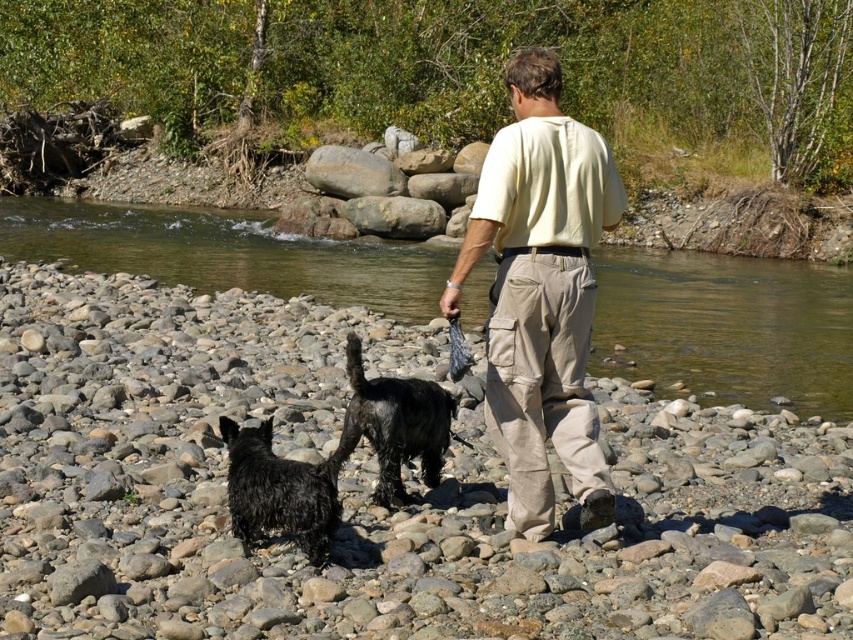
Question: Does clear water at river center have a greater width compared to khaki cargo pants at center?

Choices:
 (A) no
 (B) yes

Answer: (B)

Question: Is beige cotton shirt at center bigger than khaki cargo pants at center?

Choices:
 (A) yes
 (B) no

Answer: (B)

Question: Which object is the closest to the clear water at river center?

Choices:
 (A) khaki cargo pants at center
 (B) smooth pebbles at center

Answer: (B)

Question: Estimate the real-world distances between objects in this image. Which object is farther from the clear water at river center?

Choices:
 (A) smooth pebbles at center
 (B) wet black fur at center
 (C) shiny black fur at center
 (D) khaki cargo pants at center

Answer: (B)

Question: Among these points, which one is nearest to the camera?

Choices:
 (A) (316, 506)
 (B) (310, 260)
 (C) (766, 621)
 (D) (392, 419)

Answer: (C)

Question: Can you confirm if smooth pebbles at center is smaller than wet black fur at center?

Choices:
 (A) no
 (B) yes

Answer: (A)